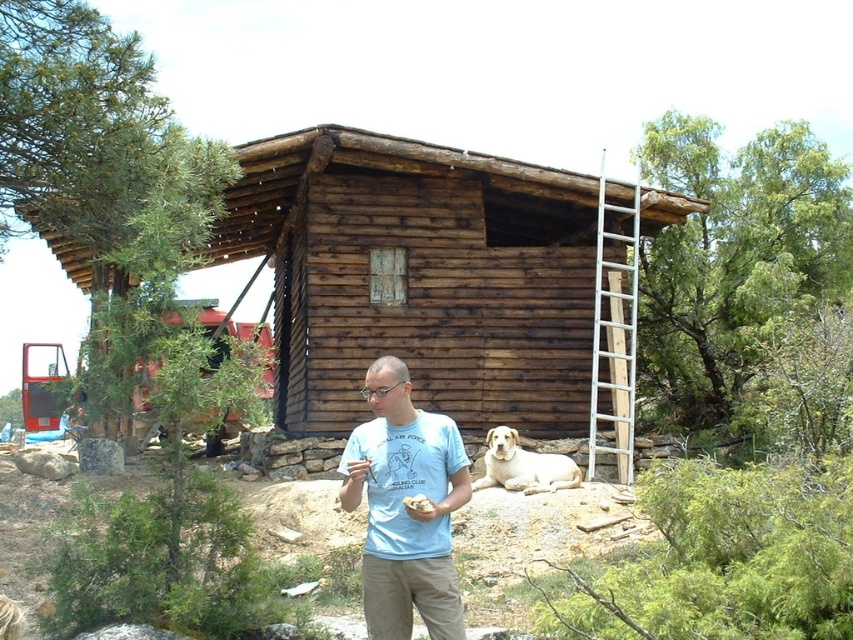
Question: Can you confirm if light blue t-shirt at center is positioned to the left of light yellow fur at lower center?

Choices:
 (A) no
 (B) yes

Answer: (B)

Question: Among these objects, which one is farthest from the camera?

Choices:
 (A) silver metallic ladder at right
 (B) light yellow fur at lower center

Answer: (A)

Question: Is brown wooden cabin at center smaller than silver metallic ladder at right?

Choices:
 (A) yes
 (B) no

Answer: (A)

Question: Which object is farther from the camera taking this photo?

Choices:
 (A) light blue t-shirt at center
 (B) silver metallic ladder at right
 (C) brown wooden cabin at center
 (D) light yellow fur at lower center

Answer: (C)

Question: Does brown wooden cabin at center appear over light blue t-shirt at center?

Choices:
 (A) no
 (B) yes

Answer: (B)

Question: Among these objects, which one is nearest to the camera?

Choices:
 (A) light blue t-shirt at center
 (B) silver metallic ladder at right

Answer: (A)